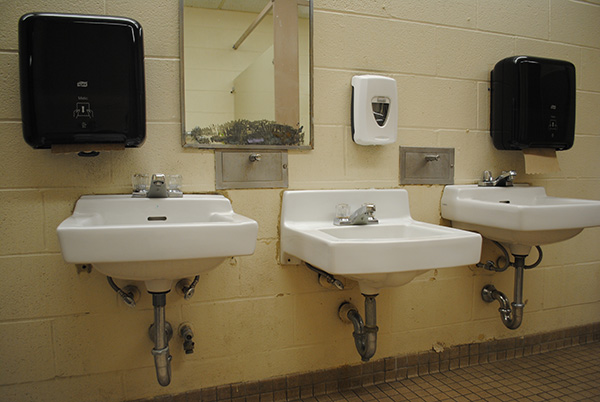
The height and width of the screenshot is (402, 600). Identify the location of dull yellow color on wall. (242, 334), (438, 322).